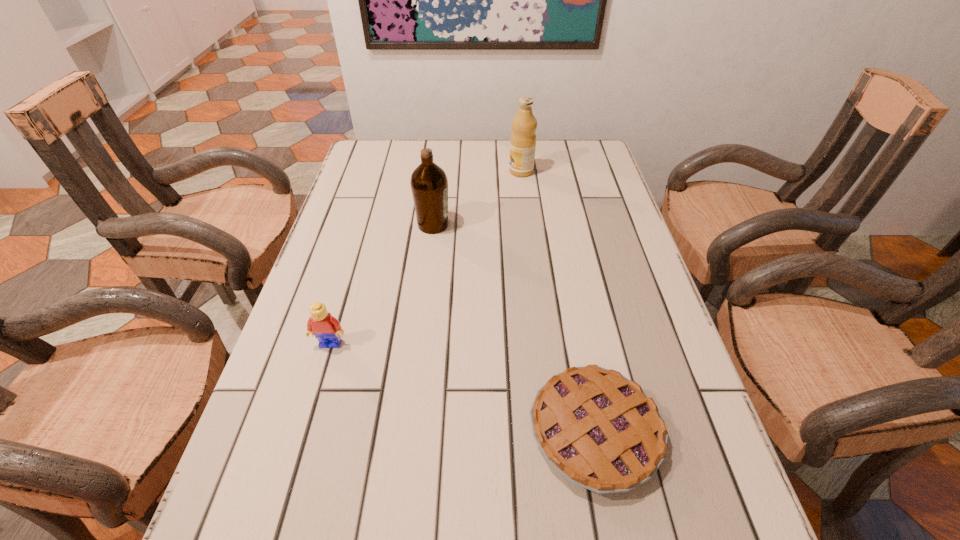
Locate an element on the screen. empty space that is in between the shortest object and the third object from right to left is located at coordinates (514, 328).

Find the location of a particular element. vacant space in between the left olive oil and the nearest object is located at coordinates (514, 328).

Locate an element on the screen. object that can be found as the closest to the right olive oil is located at coordinates (429, 184).

Locate which object is the closest to the nearer olive oil. Please provide its 2D coordinates. Your answer should be formatted as a tuple, i.e. [(x, y)], where the tuple contains the x and y coordinates of a point satisfying the conditions above.

[(523, 138)]

What are the coordinates of `vacant area in the image that satisfies the following two spatial constraints: 1. on the label of the farthest object; 2. on the front-facing side of the second nearest object` in the screenshot? It's located at (542, 343).

Locate an element on the screen. The height and width of the screenshot is (540, 960). free space that satisfies the following two spatial constraints: 1. on the label of the farthest object; 2. on the back side of the nearest object is located at coordinates (553, 431).

Identify the location of free region that satisfies the following two spatial constraints: 1. on the label of the third nearest object; 2. on the front-facing side of the third farthest object. (419, 343).

The height and width of the screenshot is (540, 960). Find the location of `free point that satisfies the following two spatial constraints: 1. on the front-facing side of the leftmost object; 2. on the left side of the shortest object`. free point that satisfies the following two spatial constraints: 1. on the front-facing side of the leftmost object; 2. on the left side of the shortest object is located at coordinates (305, 431).

Where is `vacant space that satisfies the following two spatial constraints: 1. on the label of the pie; 2. on the right side of the left olive oil`? vacant space that satisfies the following two spatial constraints: 1. on the label of the pie; 2. on the right side of the left olive oil is located at coordinates (408, 431).

What are the coordinates of `vacant space that satisfies the following two spatial constraints: 1. on the front-facing side of the third farthest object; 2. on the right side of the shortest object` in the screenshot? It's located at click(305, 431).